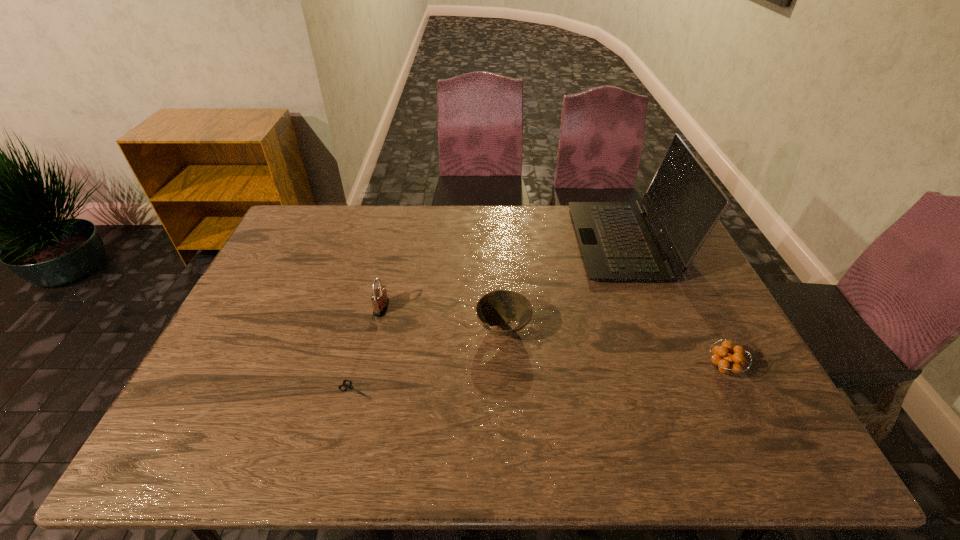
Find the location of a particular element. This screenshot has width=960, height=540. the farthest object is located at coordinates (618, 243).

The height and width of the screenshot is (540, 960). I want to click on laptop computer, so click(x=618, y=243).

Image resolution: width=960 pixels, height=540 pixels. I want to click on padlock, so click(x=380, y=301).

Identify the location of the third object from left to right. (497, 308).

Where is `orange fruit`? The width and height of the screenshot is (960, 540). orange fruit is located at coordinates (727, 362).

Find the location of `shears`. shears is located at coordinates click(347, 387).

Find the location of `vacant space situated 0.230m on the screen of the laptop computer`. vacant space situated 0.230m on the screen of the laptop computer is located at coordinates (510, 241).

Identify the location of vacant space located 0.140m on the screen of the laptop computer. (536, 241).

Where is `vacant space located 0.390m on the screen of the laptop computer`? vacant space located 0.390m on the screen of the laptop computer is located at coordinates (463, 241).

Locate an element on the screen. vacant space located 0.200m on the right of the padlock is located at coordinates (457, 308).